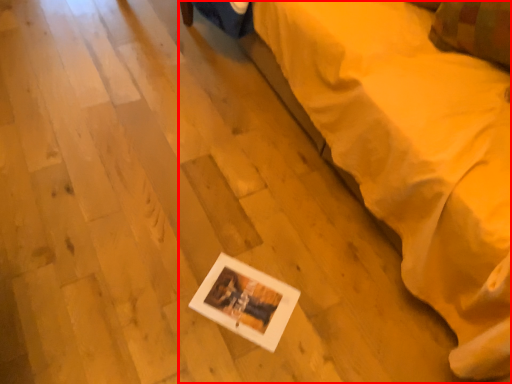
Question: Observing the image, what is the correct spatial positioning of furniture (annotated by the red box) in reference to pillow?

Choices:
 (A) left
 (B) right

Answer: (A)